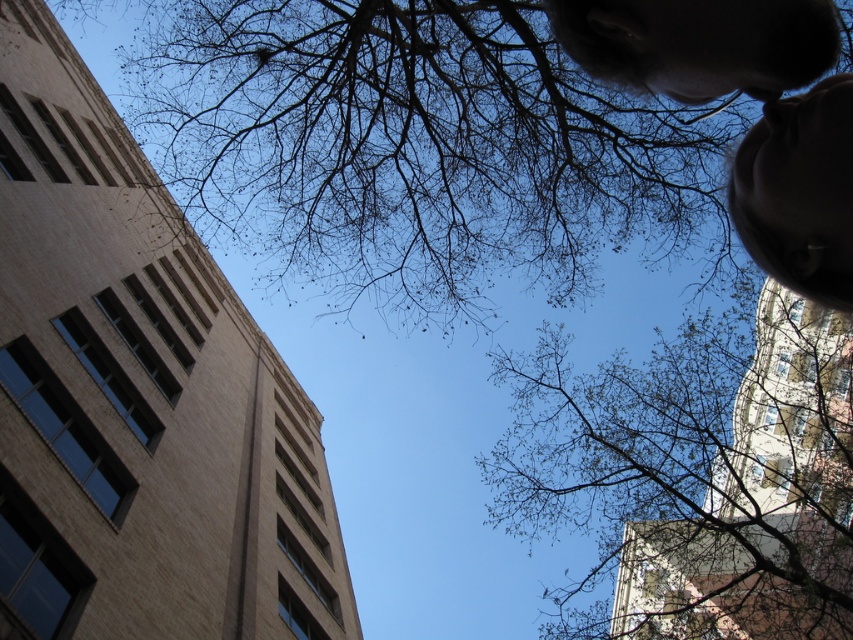
Question: From the image, what is the correct spatial relationship of beige brick building at left in relation to brown leafless branches at upper center?

Choices:
 (A) right
 (B) left

Answer: (B)

Question: Is brown leafless branches at upper center wider than bare branches at upper center?

Choices:
 (A) no
 (B) yes

Answer: (B)

Question: Is beige brick building at left to the right of brown leafless branches at upper center from the viewer's perspective?

Choices:
 (A) yes
 (B) no

Answer: (B)

Question: Which point is farther from the camera taking this photo?

Choices:
 (A) (532, 364)
 (B) (541, 8)
 (C) (187, 568)

Answer: (A)

Question: Which object appears farthest from the camera in this image?

Choices:
 (A) brown leafless branches at upper center
 (B) beige brick building at left
 (C) bare branches at upper center

Answer: (C)

Question: Which object appears closest to the camera in this image?

Choices:
 (A) bare branches at upper center
 (B) brown leafless branches at upper center
 (C) beige brick building at left

Answer: (B)